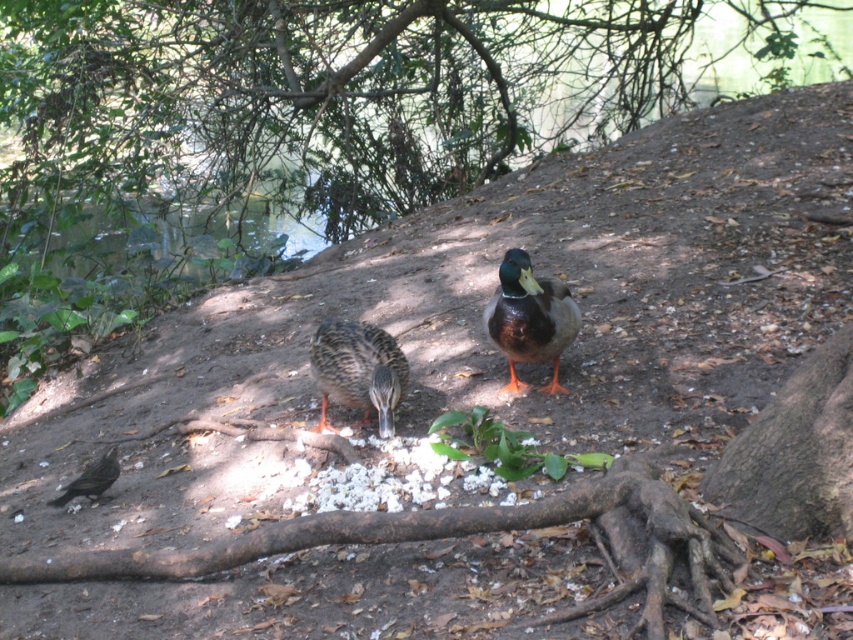
Who is lower down, shiny brown duck at center or brown speckled duck at center?

Positioned lower is brown speckled duck at center.

Is point (538, 362) closer to viewer compared to point (344, 396)?

No.

You are a GUI agent. You are given a task and a screenshot of the screen. Output one action in this format:
    pyautogui.click(x=<x>, y=<y>)
    Task: Click on the shiny brown duck at center
    This screenshot has height=640, width=853.
    Given the screenshot: What is the action you would take?
    pyautogui.click(x=529, y=317)

Does brown speckled duck at center appear under shiny black bird at lower left?

Actually, brown speckled duck at center is above shiny black bird at lower left.

Is point (340, 401) positioned in front of point (94, 472)?

No, (340, 401) is behind (94, 472).

The height and width of the screenshot is (640, 853). I want to click on brown speckled duck at center, so click(x=358, y=371).

Which is above, green leafy tree at upper center or shiny black bird at lower left?

Positioned higher is green leafy tree at upper center.

Consider the image. Can you confirm if green leafy tree at upper center is positioned to the right of shiny black bird at lower left?

Indeed, green leafy tree at upper center is positioned on the right side of shiny black bird at lower left.

Which is in front, point (512, 93) or point (102, 484)?

Point (102, 484)

Locate an element on the screen. The height and width of the screenshot is (640, 853). green leafy tree at upper center is located at coordinates (350, 90).